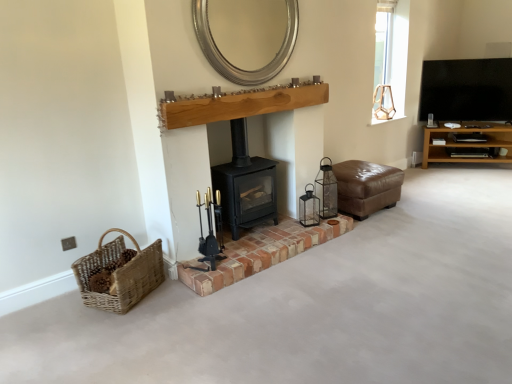
Question: Is metallic lantern at center, marked as the 1th candle holder in a right-to-left arrangement, oriented towards brown leather ottoman at center-right?

Choices:
 (A) no
 (B) yes

Answer: (A)

Question: Is brown leather ottoman at center-right a part of metallic lantern at center, marked as the 1th candle holder in a right-to-left arrangement?

Choices:
 (A) yes
 (B) no

Answer: (B)

Question: From the image's perspective, is metallic lantern at center, acting as the first candle holder starting from the back, on brown leather ottoman at center-right?

Choices:
 (A) no
 (B) yes

Answer: (A)

Question: Is metallic lantern at center, the second candle holder in the front-to-back sequence, not within brown leather ottoman at center-right?

Choices:
 (A) no
 (B) yes

Answer: (B)

Question: Considering the relative positions of metallic lantern at center, which is the second candle holder from left to right, and brown leather ottoman at center-right in the image provided, is metallic lantern at center, which is the second candle holder from left to right, to the right of brown leather ottoman at center-right from the viewer's perspective?

Choices:
 (A) yes
 (B) no

Answer: (B)

Question: Is metallic lantern at center, acting as the first candle holder starting from the back, oriented away from brown leather ottoman at center-right?

Choices:
 (A) no
 (B) yes

Answer: (A)

Question: Can you confirm if natural wood mantle at center is bigger than black matte wood burning stove at center?

Choices:
 (A) yes
 (B) no

Answer: (B)

Question: Does natural wood mantle at center have a smaller size compared to black matte wood burning stove at center?

Choices:
 (A) no
 (B) yes

Answer: (B)

Question: Is natural wood mantle at center aimed at black matte wood burning stove at center?

Choices:
 (A) yes
 (B) no

Answer: (B)

Question: Is black matte wood burning stove at center inside natural wood mantle at center?

Choices:
 (A) no
 (B) yes

Answer: (A)

Question: From the image's perspective, does natural wood mantle at center appear higher than black matte wood burning stove at center?

Choices:
 (A) yes
 (B) no

Answer: (A)

Question: Is natural wood mantle at center at the left side of black matte wood burning stove at center?

Choices:
 (A) no
 (B) yes

Answer: (A)

Question: Does brown leather ottoman at center-right have a greater width compared to silver metallic mirror at upper center?

Choices:
 (A) yes
 (B) no

Answer: (A)